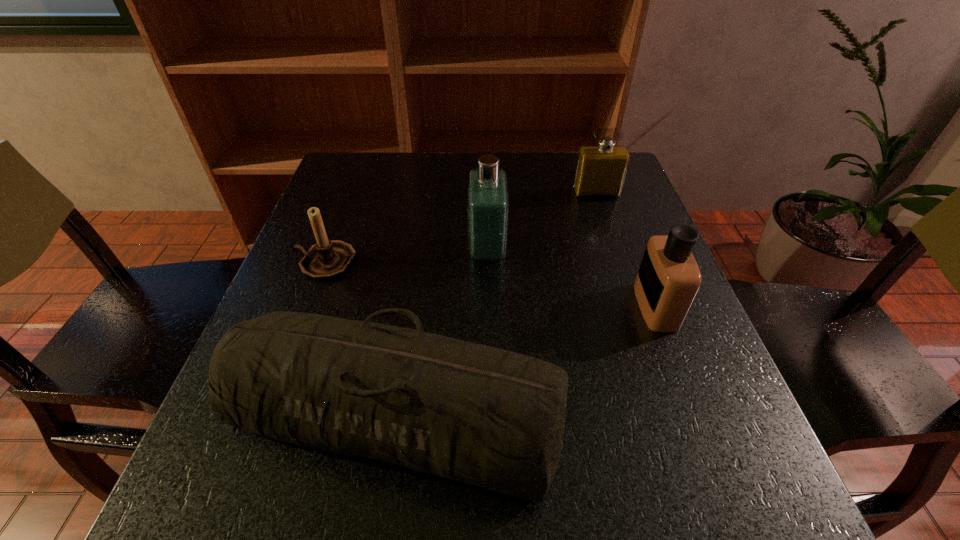
Locate an element on the screen. object that is at the far right corner is located at coordinates (601, 169).

This screenshot has width=960, height=540. In order to click on free region at the far edge of the desktop in this screenshot , I will do `click(396, 192)`.

Locate an element on the screen. Image resolution: width=960 pixels, height=540 pixels. blank space at the near edge of the desktop is located at coordinates (326, 475).

Where is `blank space at the left edge`? blank space at the left edge is located at coordinates (328, 204).

You are a GUI agent. You are given a task and a screenshot of the screen. Output one action in this format:
    pyautogui.click(x=<x>, y=<y>)
    Task: Click on the vacant area at the right edge of the desktop
    Image resolution: width=960 pixels, height=540 pixels.
    Given the screenshot: What is the action you would take?
    pyautogui.click(x=601, y=218)

I want to click on vacant area at the far left corner, so click(322, 194).

Locate an element on the screen. free space at the near left corner is located at coordinates (266, 515).

Where is `free area in between the duffel bag and the farthest object`? This screenshot has height=540, width=960. free area in between the duffel bag and the farthest object is located at coordinates (495, 303).

This screenshot has width=960, height=540. Find the location of `free point between the second nearest object and the candle holder`. free point between the second nearest object and the candle holder is located at coordinates (491, 284).

Image resolution: width=960 pixels, height=540 pixels. Identify the location of vacant space that's between the farthest perfume and the nearest object. pyautogui.click(x=495, y=303).